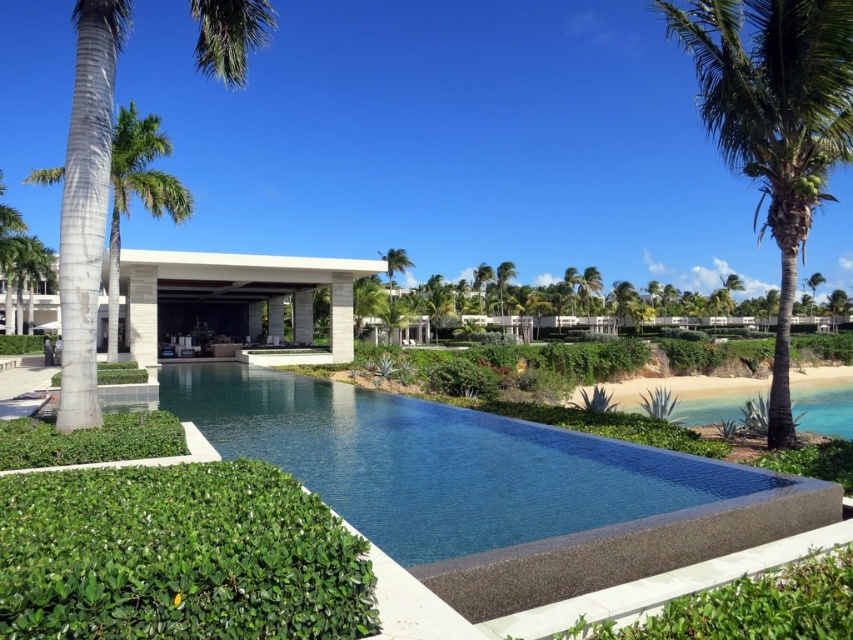
You are a guest staying at the beige stone resort at center and want to take a photo of the gray textured palm tree at left. From your current position, which direction should you face to capture the palm tree in your shot?

The gray textured palm tree at left is positioned on the right side of beige stone resort at center, so you should face to the right to capture the palm tree in your shot.

You are standing at the edge of the infinity pool and want to take a photo of the gray textured palm tree at left. If your camera has a maximum focus range of 6 meters, will it be able to capture the palm tree clearly?

The gray textured palm tree at left is 6.46 meters away from the camera. Since the camera can only focus up to 6 meters, it will not be able to capture the palm tree clearly.